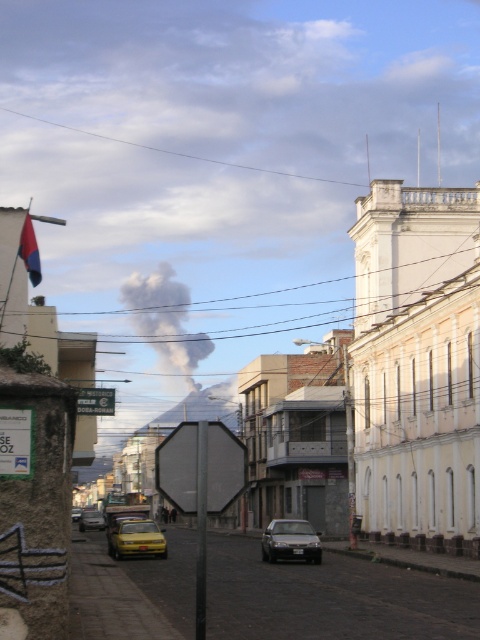
Question: Which point is farther to the camera?

Choices:
 (A) blue fabric flag at upper left
 (B) gray smoke at center

Answer: (B)

Question: Which object appears closest to the camera in this image?

Choices:
 (A) green plastic sign at center
 (B) yellow matte car at center

Answer: (A)

Question: From the image, what is the correct spatial relationship of gray smoke at center in relation to yellow matte car at lower left?

Choices:
 (A) left
 (B) right

Answer: (A)

Question: In this image, where is gray smoke at center located relative to yellow matte car at lower left?

Choices:
 (A) above
 (B) below

Answer: (A)

Question: Considering the real-world distances, which object is closest to the green plastic sign at center?

Choices:
 (A) metallic yellow car at center
 (B) yellow matte taxi at center
 (C) blue fabric flag at upper left

Answer: (C)

Question: Does silver metallic sedan at center have a lesser width compared to yellow matte car at lower left?

Choices:
 (A) no
 (B) yes

Answer: (B)